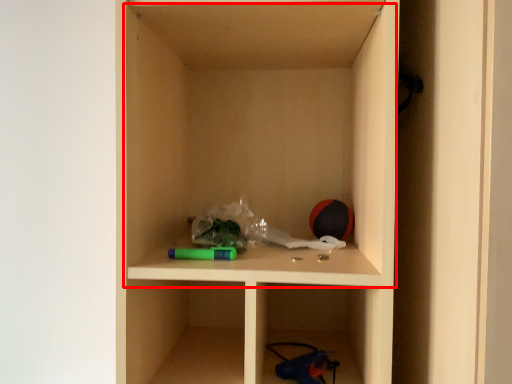
Question: Where is cabinet (annotated by the red box) located in relation to toy in the image?

Choices:
 (A) right
 (B) left

Answer: (B)